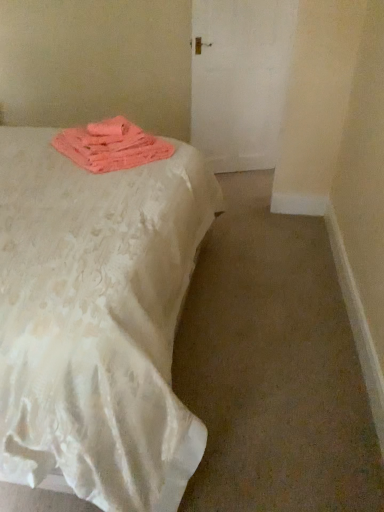
This screenshot has height=512, width=384. Describe the element at coordinates (97, 321) in the screenshot. I see `white textured bed at left` at that location.

I want to click on white textured bed at left, so click(97, 321).

This screenshot has width=384, height=512. I want to click on pink fabric at upper left, so click(111, 146).

The image size is (384, 512). Describe the element at coordinates (111, 146) in the screenshot. I see `pink fabric at upper left` at that location.

The width and height of the screenshot is (384, 512). Identify the location of white textured bed at left. (97, 321).

Between pink fabric at upper left and white textured bed at left, which one appears on the left side from the viewer's perspective?

Positioned to the left is white textured bed at left.

Is the depth of pink fabric at upper left greater than that of white textured bed at left?

Yes, it is.

Between point (170, 148) and point (142, 176), which one is positioned in front?

Positioned in front is point (142, 176).

From the image's perspective, which one is positioned lower, pink fabric at upper left or white textured bed at left?

From the image's view, white textured bed at left is below.

From a real-world perspective, is pink fabric at upper left physically located above or below white textured bed at left?

From a real-world perspective, pink fabric at upper left is physically above white textured bed at left.

Considering the sizes of pink fabric at upper left and white textured bed at left in the image, is pink fabric at upper left wider or thinner than white textured bed at left?

Considering their sizes, pink fabric at upper left looks slimmer than white textured bed at left.

Is pink fabric at upper left shorter than white textured bed at left?

Yes.

Who is smaller, pink fabric at upper left or white textured bed at left?

With smaller size is pink fabric at upper left.

Is pink fabric at upper left inside or outside of white textured bed at left?

pink fabric at upper left lies within the bounds of white textured bed at left.

Is pink fabric at upper left beside white textured bed at left?

No, pink fabric at upper left is not touching white textured bed at left.

Is white textured bed at left at the back of pink fabric at upper left?

Yes.

Measure the distance from pink fabric at upper left to white textured bed at left.

pink fabric at upper left and white textured bed at left are 16.65 inches apart from each other.

Locate an element on the screen. bed below the pink fabric at upper left (from a real-world perspective) is located at coordinates (97, 321).

From the picture: Which object is positioned more to the left, white textured bed at left or pink fabric at upper left?

white textured bed at left is more to the left.

Who is more distant, white textured bed at left or pink fabric at upper left?

Positioned behind is pink fabric at upper left.

Which point is more distant from viewer, (172, 224) or (61, 148)?

The point (61, 148) is more distant.

From the image's perspective, is white textured bed at left under pink fabric at upper left?

Correct, white textured bed at left appears lower than pink fabric at upper left in the image.

From a real-world perspective, is white textured bed at left positioned above or below pink fabric at upper left?

Clearly, from a real-world perspective, white textured bed at left is below pink fabric at upper left.

In terms of width, does white textured bed at left look wider or thinner when compared to pink fabric at upper left?

Clearly, white textured bed at left has more width compared to pink fabric at upper left.

Is white textured bed at left shorter than pink fabric at upper left?

No, white textured bed at left is not shorter than pink fabric at upper left.

Looking at the image, does white textured bed at left seem bigger or smaller compared to pink fabric at upper left?

white textured bed at left is bigger than pink fabric at upper left.

Is white textured bed at left located outside pink fabric at upper left?

Indeed, white textured bed at left is completely outside pink fabric at upper left.

Would you consider white textured bed at left to be distant from pink fabric at upper left?

They are positioned close to each other.

Is white textured bed at left aimed at pink fabric at upper left?

Yes, white textured bed at left is turned towards pink fabric at upper left.

Where is `bed located underneath the pink fabric at upper left (from a real-world perspective)`? Image resolution: width=384 pixels, height=512 pixels. bed located underneath the pink fabric at upper left (from a real-world perspective) is located at coordinates (97, 321).

The width and height of the screenshot is (384, 512). Find the location of `cloth on the right of the white textured bed at left`. cloth on the right of the white textured bed at left is located at coordinates (111, 146).

You are a GUI agent. You are given a task and a screenshot of the screen. Output one action in this format:
    pyautogui.click(x=<x>, y=<y>)
    Task: Click on the cloth above the white textured bed at left (from the image's perspective)
    
    Given the screenshot: What is the action you would take?
    pyautogui.click(x=111, y=146)